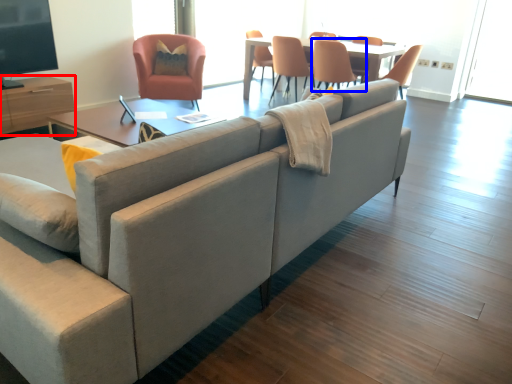
Question: Which object is further to the camera taking this photo, entertainment center (highlighted by a red box) or chair (highlighted by a blue box)?

Choices:
 (A) entertainment center
 (B) chair

Answer: (B)